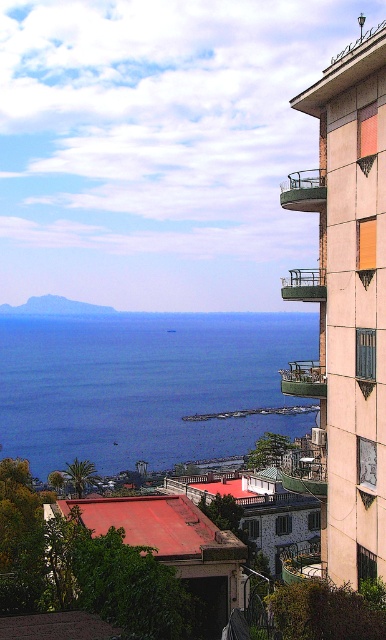
Between blue water at lower left and metallic balcony at upper right, which one has less height?

metallic balcony at upper right is shorter.

Who is more distant from viewer, (255, 324) or (313, 196)?

Positioned behind is point (255, 324).

Locate an element on the screen. blue water at lower left is located at coordinates (145, 385).

Who is shorter, blue water at lower left or green metal balcony at upper right?

With less height is green metal balcony at upper right.

Can you confirm if blue water at lower left is thinner than green metal balcony at upper right?

In fact, blue water at lower left might be wider than green metal balcony at upper right.

Is point (281, 358) closer to viewer compared to point (304, 296)?

No, it is not.

At what (x,y) coordinates should I click in order to perform the action: click on blue water at lower left. Please return your answer as a coordinate pair (x, y). Looking at the image, I should click on (145, 385).

Who is positioned more to the right, metallic balcony at upper right or green metal balcony at upper right?

green metal balcony at upper right

Who is more forward, (323, 196) or (286, 276)?

Point (323, 196) is in front.

Identify the location of metallic balcony at upper right. The height and width of the screenshot is (640, 386). (304, 189).

Find the location of a particular element. The height and width of the screenshot is (640, 386). metallic balcony at upper right is located at coordinates (304, 189).